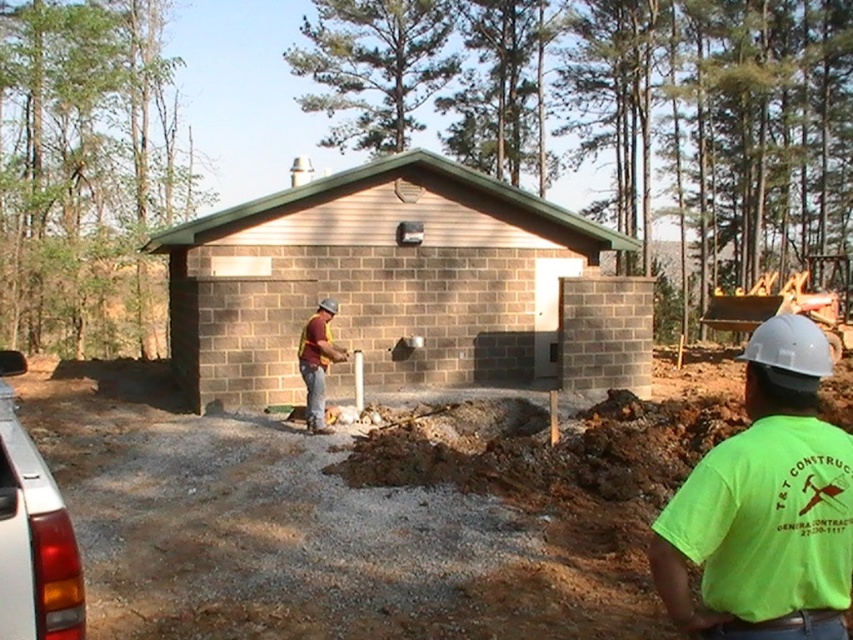
You are a safety inspector at the construction site and need to check two points marked on the blueprint. The first point is at coordinate point (772, 589) and the second is at point (320, 321). Which point is closer to you?

Point (772, 589) is closer to the viewer than point (320, 321).

You are standing at the origin point of the coordinate system where the camera is located. The construction site has a coordinate grid overlay. Where is the brown brick building at center located in terms of coordinates?

The brown brick building at center is located at coordinates point (375, 280).